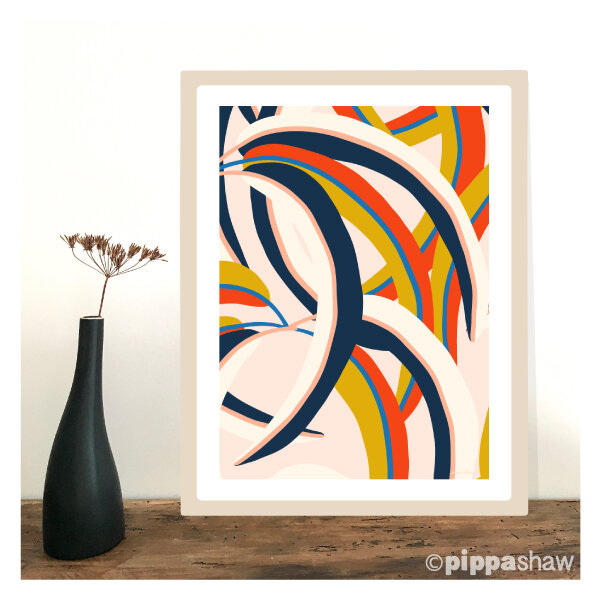
Identify the location of table. (308, 538).